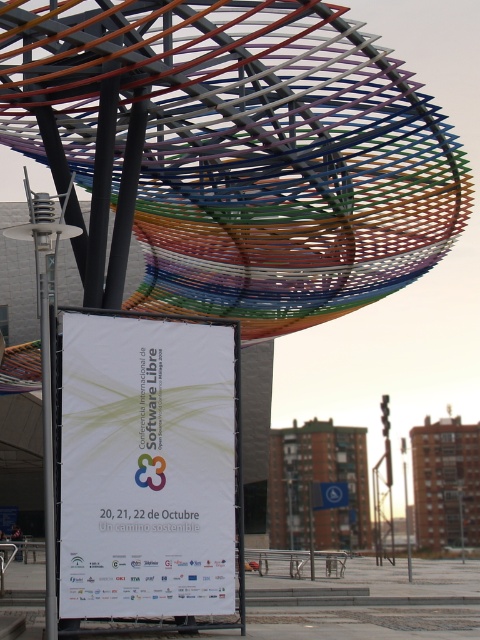
Based on the photo, you are a photographer standing in front of the sculpture. You want to take a photo that includes both the white banner and the colorful sculpture. Which point, point (122, 4) or point (188, 598), is closer to you?

Point (122, 4) is further to the camera than point (188, 598). Therefore, point (188, 598) is closer to you.

You are attending the International Conference on Free Software and need to place a promotional poster on the ground. The metallic wire mesh canopy at upper center is above the white paper at center. Where should you place the poster to ensure it stays dry during rain?

Place the poster on the white paper at center because the metallic wire mesh canopy at upper center is positioned over it, providing shelter from the rain.